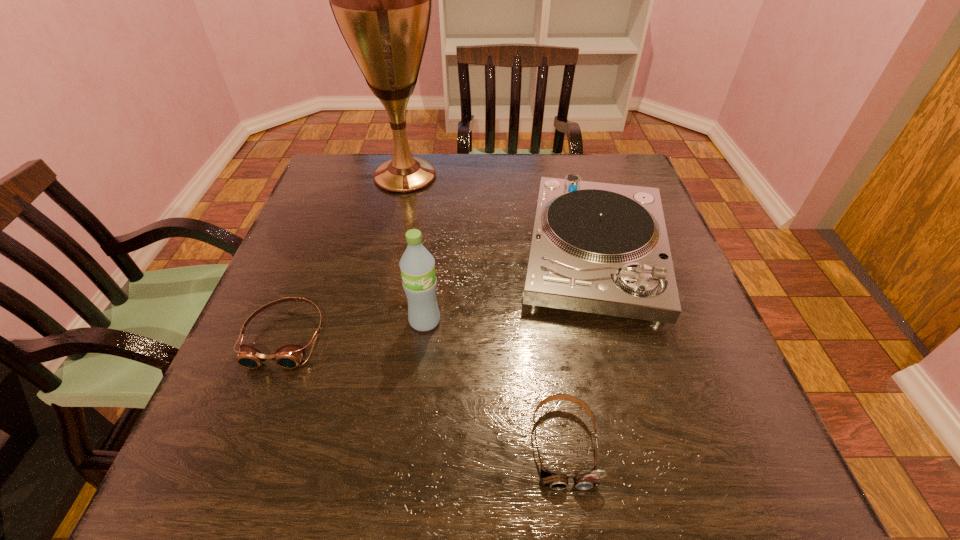
You are a GUI agent. You are given a task and a screenshot of the screen. Output one action in this format:
    pyautogui.click(x=<x>, y=<y>)
    Task: Click on the tallest object
    This screenshot has height=540, width=960.
    Given the screenshot: What is the action you would take?
    pyautogui.click(x=381, y=0)

At what (x,y) coordinates should I click in order to perform the action: click on the second tallest object. Please return your answer as a coordinate pair (x, y). This screenshot has width=960, height=540. Looking at the image, I should click on (417, 265).

This screenshot has width=960, height=540. Find the location of `the third tallest object`. the third tallest object is located at coordinates (602, 248).

Image resolution: width=960 pixels, height=540 pixels. Identify the location of the left goggles. (289, 356).

What are the coordinates of `the right goggles` in the screenshot? It's located at (555, 481).

Find the location of `the nearest object`. the nearest object is located at coordinates (555, 481).

The height and width of the screenshot is (540, 960). In order to click on free region located 0.340m on the right of the trophy cup in this screenshot , I will do `click(566, 176)`.

I want to click on vacant region located 0.090m on the right of the water bottle, so click(487, 321).

The height and width of the screenshot is (540, 960). I want to click on vacant area situated 0.070m on the back of the third tallest object, so click(x=575, y=183).

At what (x,y) coordinates should I click in order to perform the action: click on free space located 0.070m through the lenses of the left goggles. Please return your answer as a coordinate pair (x, y). The height and width of the screenshot is (540, 960). Looking at the image, I should click on (258, 407).